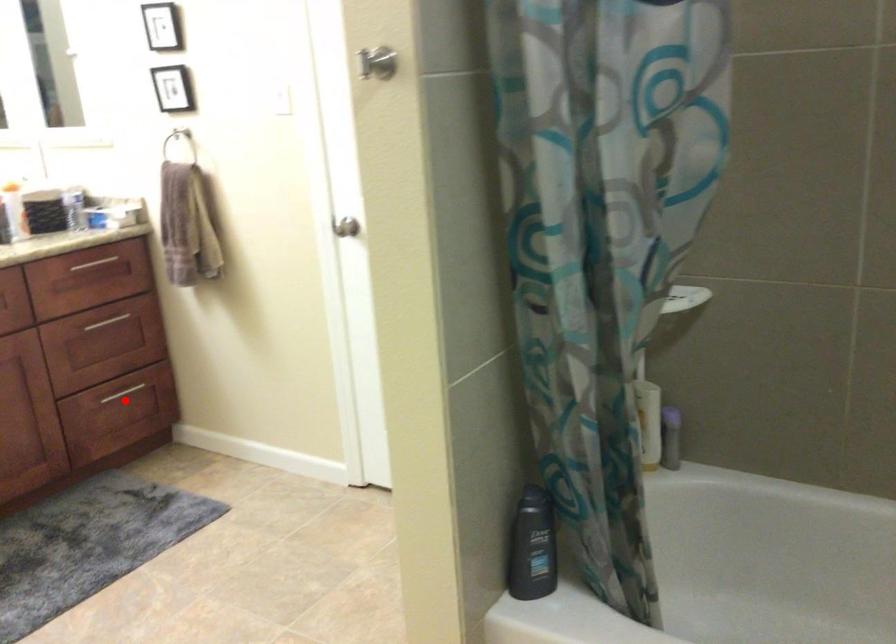
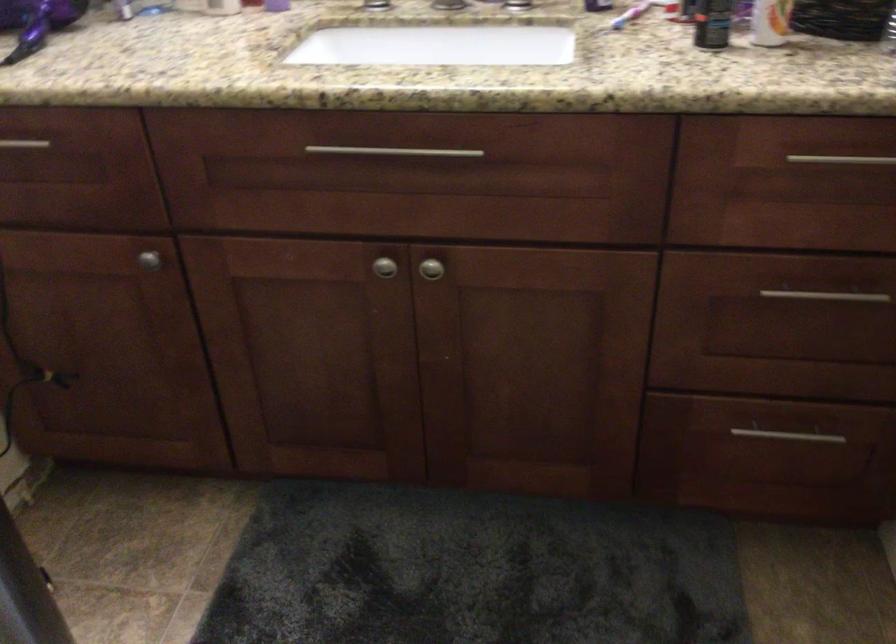
Question: I am providing you with two images of the same scene from different viewpoints. Image1 has a red point marked. In image2, the corresponding 3D location appears at what relative position? Reply with the corresponding letter.

Choices:
 (A) Closer
 (B) Farther

Answer: (A)